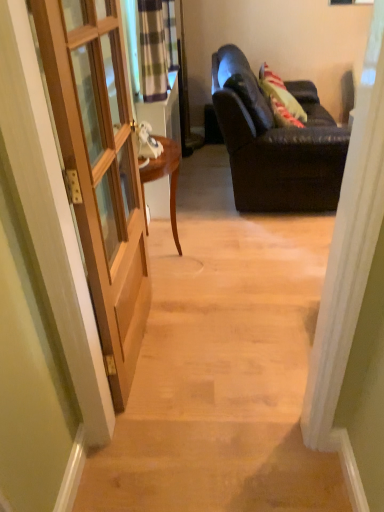
This screenshot has height=512, width=384. I want to click on free spot above wooden door at left (from a real-world perspective), so click(x=232, y=259).